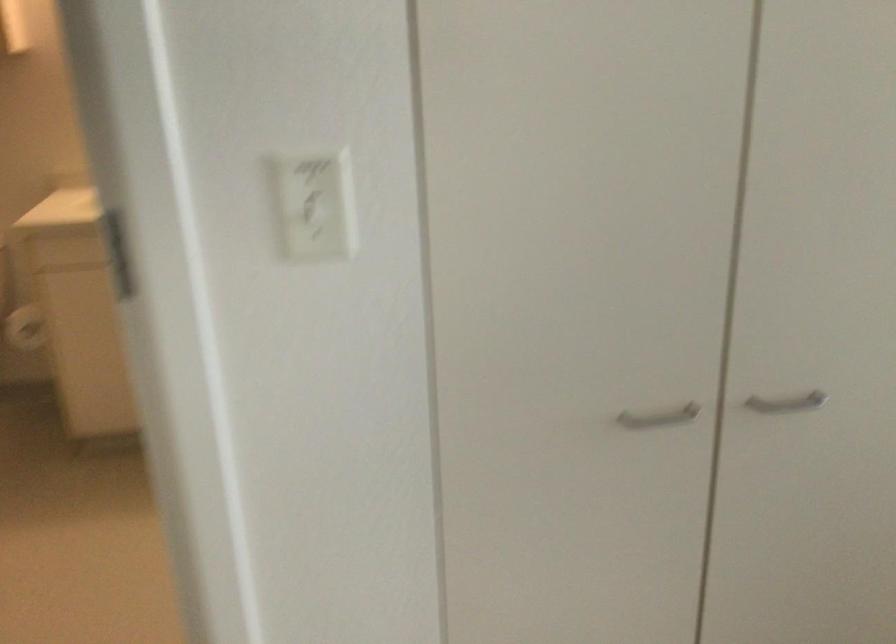
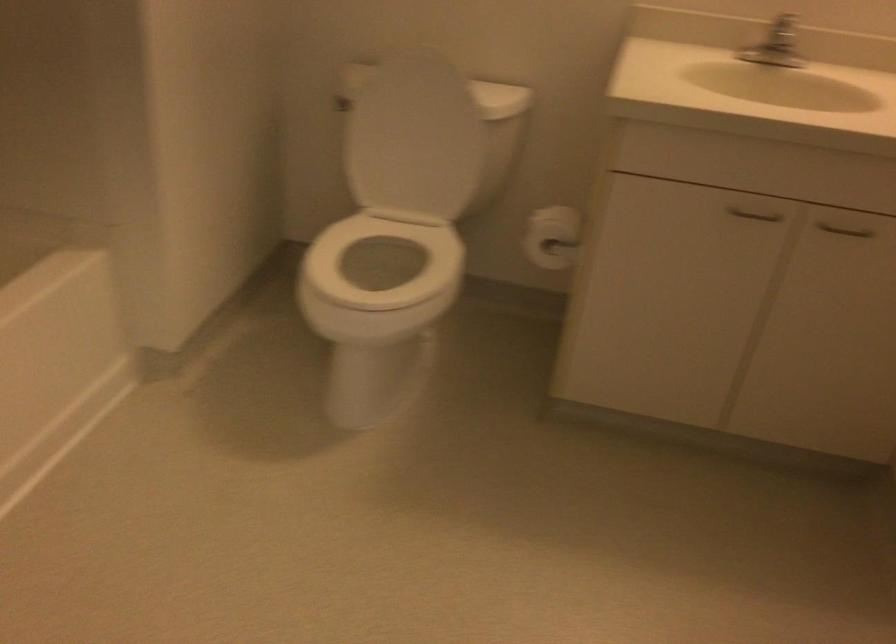
Which direction would the cameraman need to move to produce the second image?

The cameraman moved toward left, forward.